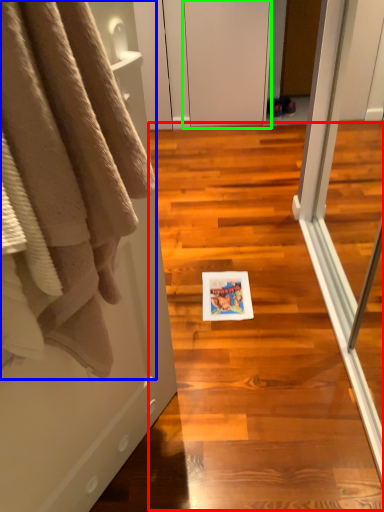
Question: Which object is the farthest from stair (highlighted by a red box)? Choose among these: towel (highlighted by a blue box) or screen door (highlighted by a green box).

Choices:
 (A) towel
 (B) screen door

Answer: (B)